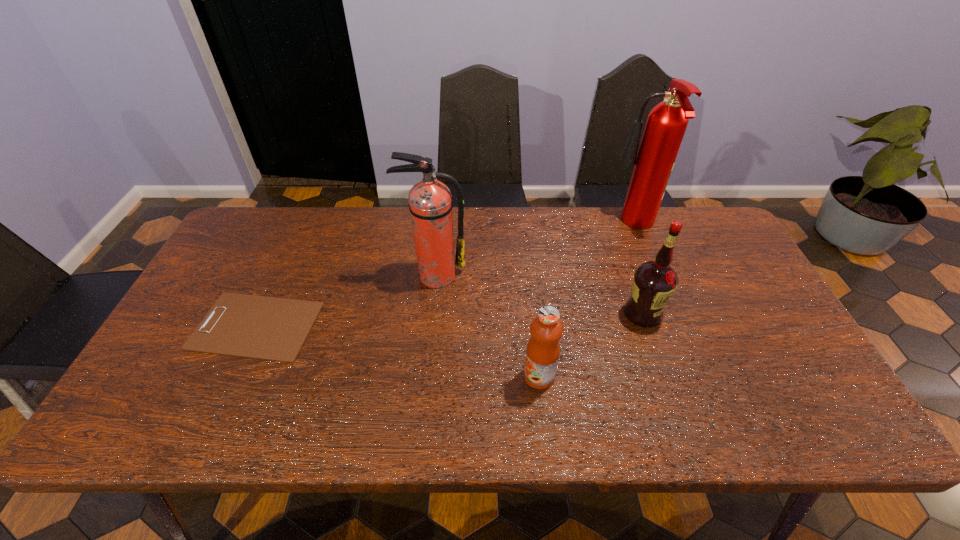
I want to click on the taller fire extinguisher, so click(666, 124).

This screenshot has width=960, height=540. Find the location of `the tallest object`. the tallest object is located at coordinates (666, 124).

The width and height of the screenshot is (960, 540). I want to click on the left fire extinguisher, so click(x=430, y=204).

You are a GUI agent. You are given a task and a screenshot of the screen. Output one action in this format:
    pyautogui.click(x=<x>, y=<y>)
    Task: Click on the nearer fire extinguisher
    The width and height of the screenshot is (960, 540).
    Given the screenshot: What is the action you would take?
    pyautogui.click(x=430, y=204)

Locate an element on the screen. This screenshot has height=540, width=960. alcohol is located at coordinates (654, 282).

Image resolution: width=960 pixels, height=540 pixels. What are the coordinates of `the nearest object` in the screenshot? It's located at (546, 329).

You are a GUI agent. You are given a task and a screenshot of the screen. Output one action in this format:
    pyautogui.click(x=<x>, y=<y>)
    Task: Click on the fruit juice
    The width and height of the screenshot is (960, 540).
    Given the screenshot: What is the action you would take?
    pyautogui.click(x=546, y=329)

Where is `the leftmost object`? Image resolution: width=960 pixels, height=540 pixels. the leftmost object is located at coordinates (269, 328).

This screenshot has height=540, width=960. Find the location of `the shortest object`. the shortest object is located at coordinates (269, 328).

Locate an element on the screen. vacant space located 0.050m at the nozzle of the taller fire extinguisher is located at coordinates (595, 226).